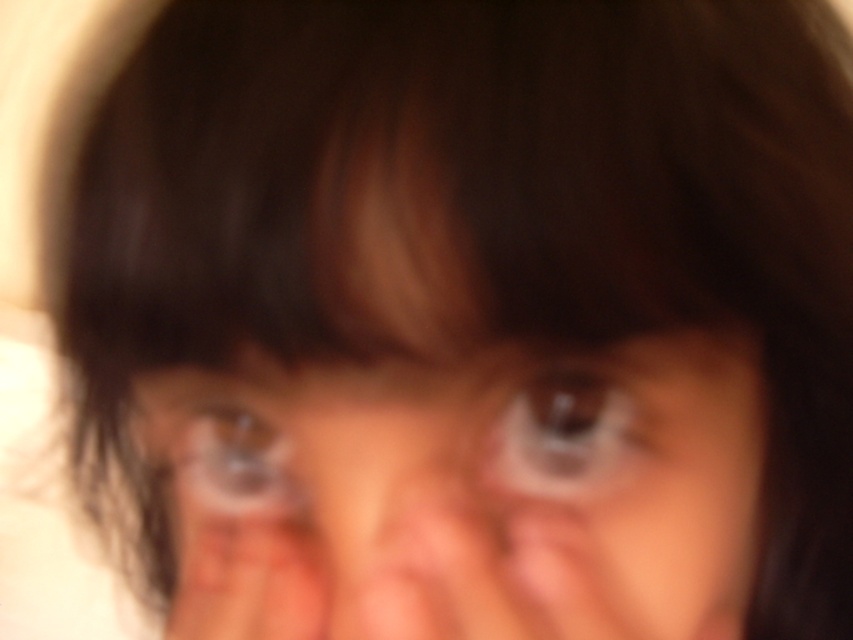
Question: Does translucent plastic eyes at center appear under translucent plastic eye at center?

Choices:
 (A) no
 (B) yes

Answer: (B)

Question: Which object is positioned closest to the translucent plastic eye at center?

Choices:
 (A) brown glossy eye at center
 (B) translucent plastic eyes at center

Answer: (B)

Question: Can you confirm if translucent plastic eyes at center is positioned to the right of brown glossy eye at center?

Choices:
 (A) yes
 (B) no

Answer: (B)

Question: Estimate the real-world distances between objects in this image. Which object is closer to the translucent plastic eye at center?

Choices:
 (A) translucent plastic eyes at center
 (B) brown glossy eye at center

Answer: (A)

Question: Can you confirm if brown glossy eye at center is positioned below translucent plastic eye at center?

Choices:
 (A) no
 (B) yes

Answer: (A)

Question: Estimate the real-world distances between objects in this image. Which object is closer to the translucent plastic eyes at center?

Choices:
 (A) translucent plastic eye at center
 (B) brown glossy eye at center

Answer: (B)